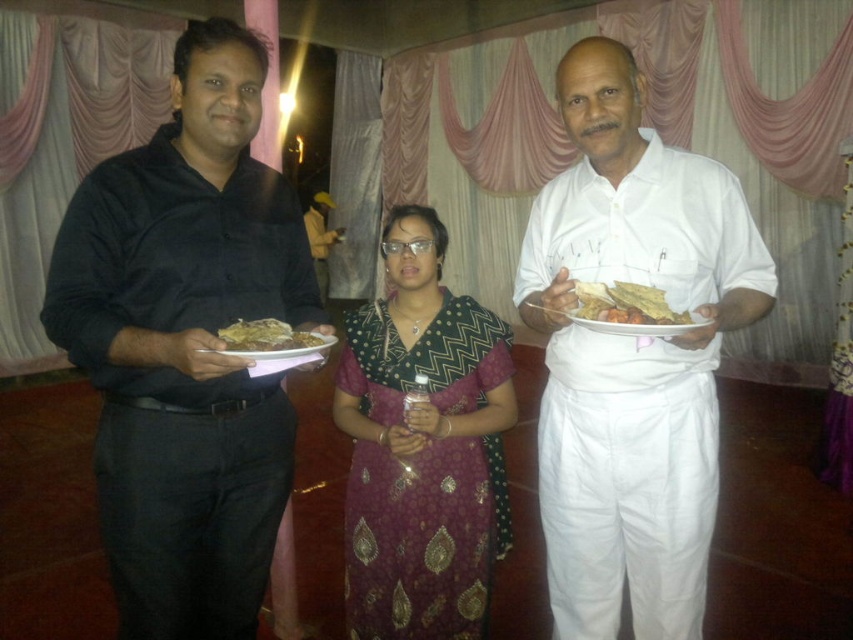
Question: Considering the relative positions of golden crispy flatbread at right and matte brown bread at left in the image provided, where is golden crispy flatbread at right located with respect to matte brown bread at left?

Choices:
 (A) left
 (B) right

Answer: (B)

Question: Does black matte shirt at left have a larger size compared to white cotton shirt at center?

Choices:
 (A) no
 (B) yes

Answer: (A)

Question: Which object appears closest to the camera in this image?

Choices:
 (A) black matte shirt at left
 (B) white cotton shirt at center
 (C) golden crispy flatbread at right

Answer: (A)

Question: Is black matte shirt at left smaller than golden crispy flatbread at right?

Choices:
 (A) yes
 (B) no

Answer: (B)

Question: Which point appears farthest from the camera in this image?

Choices:
 (A) (408, 288)
 (B) (709, 365)

Answer: (A)

Question: Estimate the real-world distances between objects in this image. Which object is closer to the white cotton shirt at center?

Choices:
 (A) black matte shirt at left
 (B) yellow fabric jacket at center

Answer: (A)